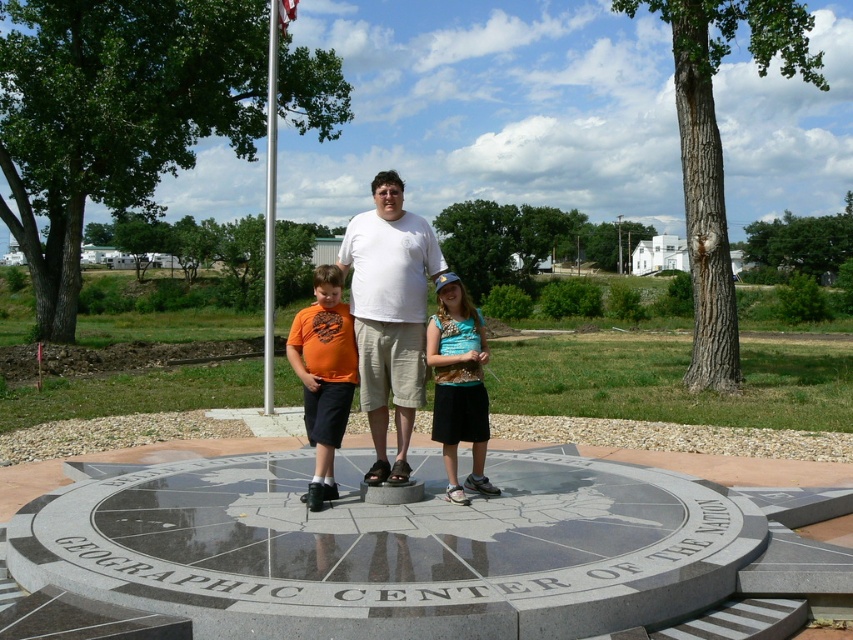
From the picture: You are standing at the Geographic Center of the United States monument and want to take a photo of the two points mentioned. Which point, point [440,372] or point [273,72], will appear larger in your photo?

Point [440,372] will appear larger in the photo because it is closer to the camera than point [273,72].

You are a photographer standing at the Geographic Center of the United States monument. You notice a turquoise fabric shirt at center and a metallic flag pole at center. Which object is closer to the ground?

The turquoise fabric shirt at center is shorter than the metallic flag pole at center, so the turquoise fabric shirt at center is closer to the ground.